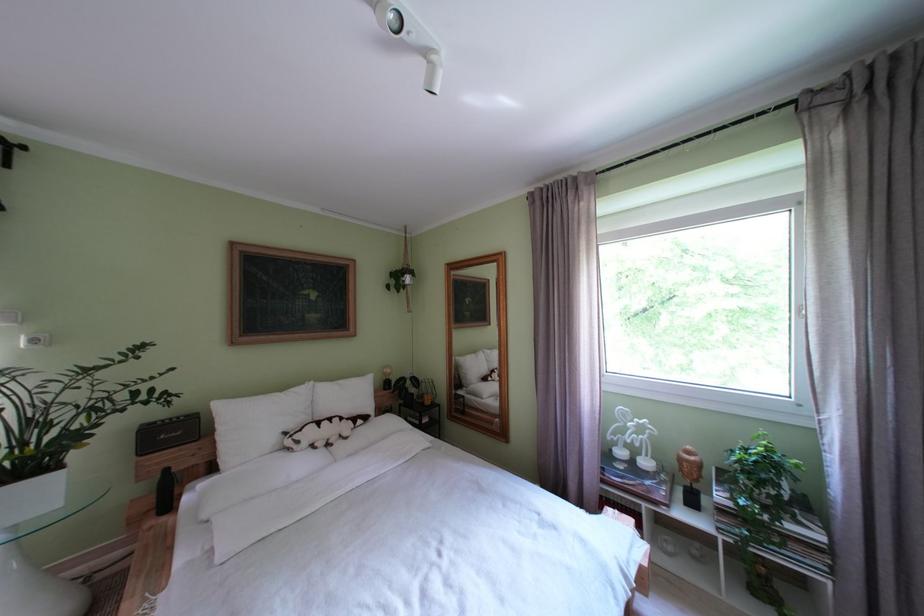
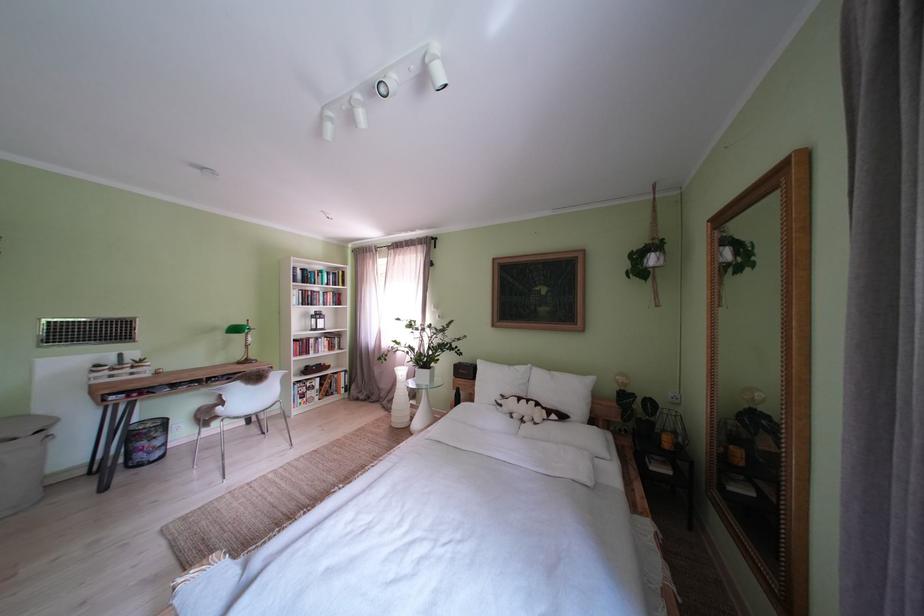
In the second image, find the point that corresponds to point 165,428 in the first image.

(472, 369)